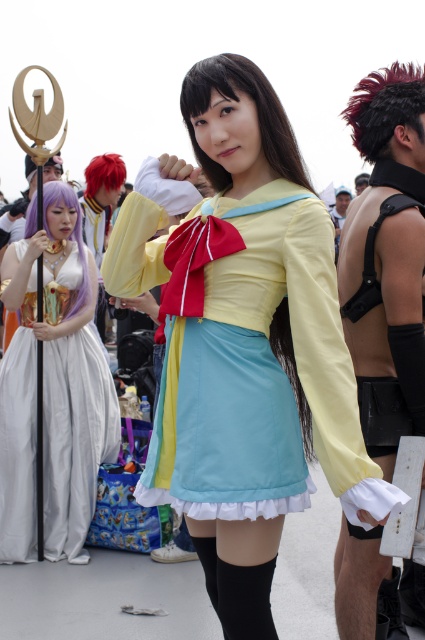
You are a photographer at the event and want to capture a photo where both the satin yellow wig at center and the purple silky wig at upper left are clearly visible. Which wig should you adjust your camera focus on to ensure both are in focus?

Since the satin yellow wig at center is closer to the viewer than the purple silky wig at upper left, you should focus on the satin yellow wig at center to ensure both are in focus as it is closer and the depth of field will extend to the further object.

You are a photographer at the cosplay event. You want to take a photo focusing on the two specific points marked as point [210,81] and point [85,256]. Which point should you adjust your focus to first if you want to capture both points clearly in the same shot?

Point [210,81] is closer to the camera than point [85,256], so you should focus on point [210,81] first to ensure both points are in focus.